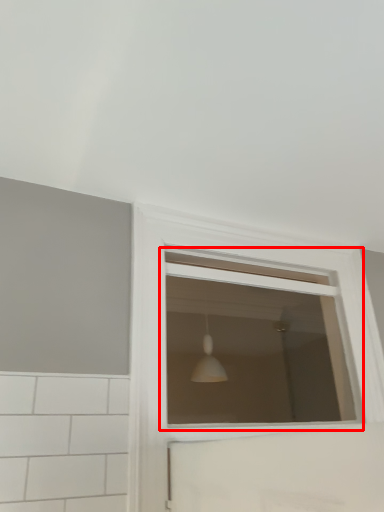
Question: From the image's perspective, considering the relative positions of window (annotated by the red box) and window in the image provided, where is window (annotated by the red box) located with respect to the staircase?

Choices:
 (A) below
 (B) above

Answer: (B)